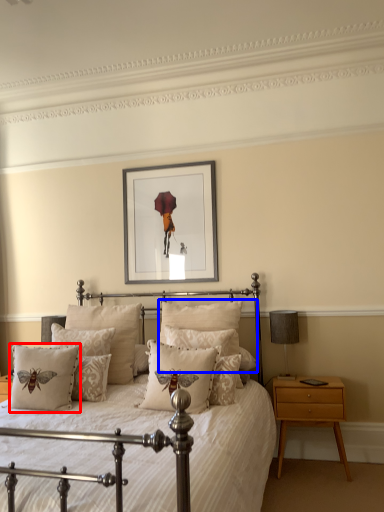
Question: Which point is further to the camera, pillow (highlighted by a red box) or pillow (highlighted by a blue box)?

Choices:
 (A) pillow
 (B) pillow

Answer: (B)